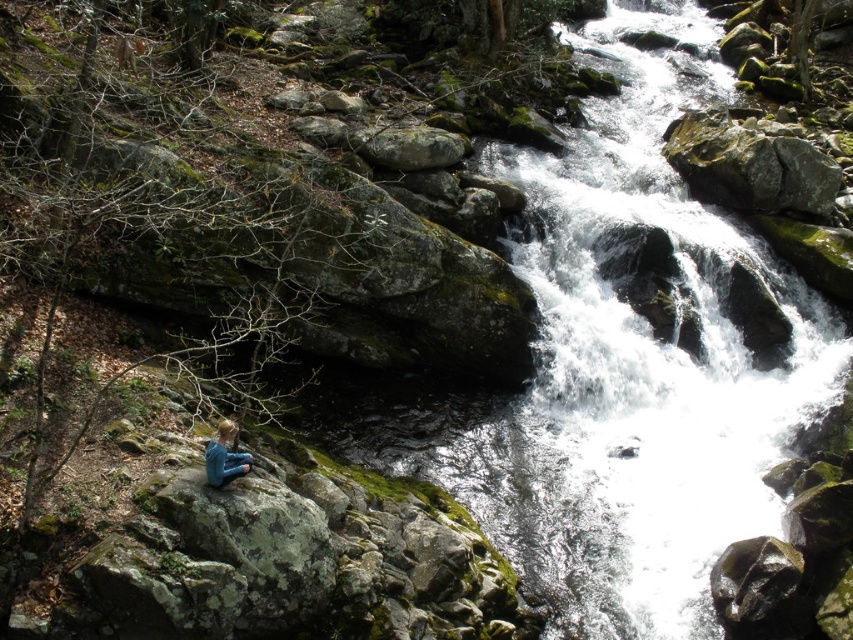
Question: Does green mossy rock at center appear under blue fabric person at lower left?

Choices:
 (A) yes
 (B) no

Answer: (B)

Question: Among these objects, which one is farthest from the camera?

Choices:
 (A) blue fabric person at lower left
 (B) green mossy rock at center

Answer: (B)

Question: Is green mossy rock at center positioned before blue fabric person at lower left?

Choices:
 (A) no
 (B) yes

Answer: (A)

Question: Which of the following is the closest to the observer?

Choices:
 (A) (668, 573)
 (B) (247, 454)

Answer: (B)

Question: Is green mossy rock at center closer to camera compared to blue fabric person at lower left?

Choices:
 (A) yes
 (B) no

Answer: (B)